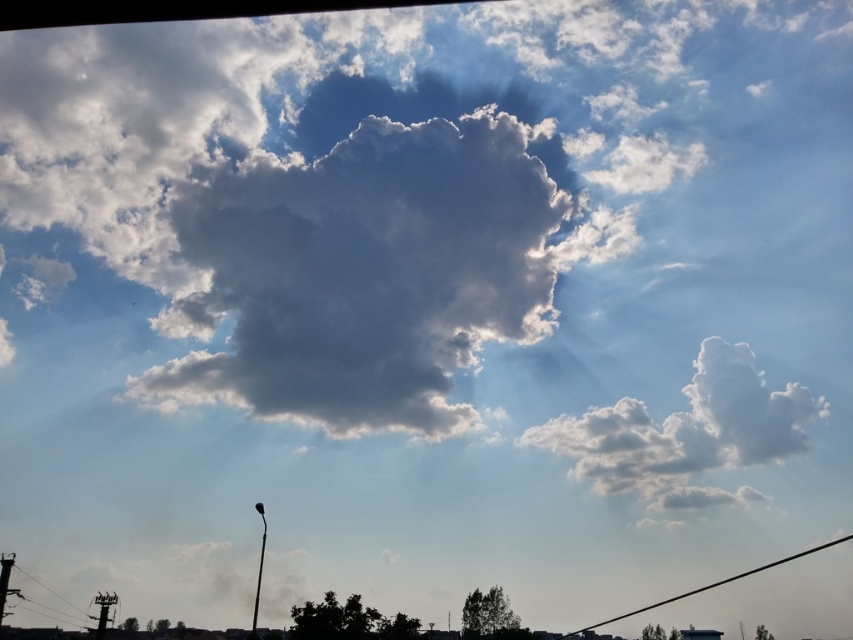
Question: Among these points, which one is nearest to the camera?

Choices:
 (A) (32, 577)
 (B) (372, 413)
 (C) (566, 435)
 (D) (670, 596)

Answer: (B)

Question: Does white fluffy cloud at center have a larger size compared to white fluffy cloud at right?

Choices:
 (A) yes
 (B) no

Answer: (B)

Question: Which object is positioned farthest from the black wire at lower left?

Choices:
 (A) white fluffy cloud at center
 (B) black wire at lower right

Answer: (B)

Question: Which object appears closest to the camera in this image?

Choices:
 (A) white fluffy cloud at right
 (B) white fluffy cloud at center

Answer: (B)

Question: Does white fluffy cloud at center appear on the right side of white fluffy cloud at right?

Choices:
 (A) yes
 (B) no

Answer: (B)

Question: Can you confirm if white fluffy cloud at center is positioned below black wire at lower left?

Choices:
 (A) yes
 (B) no

Answer: (B)